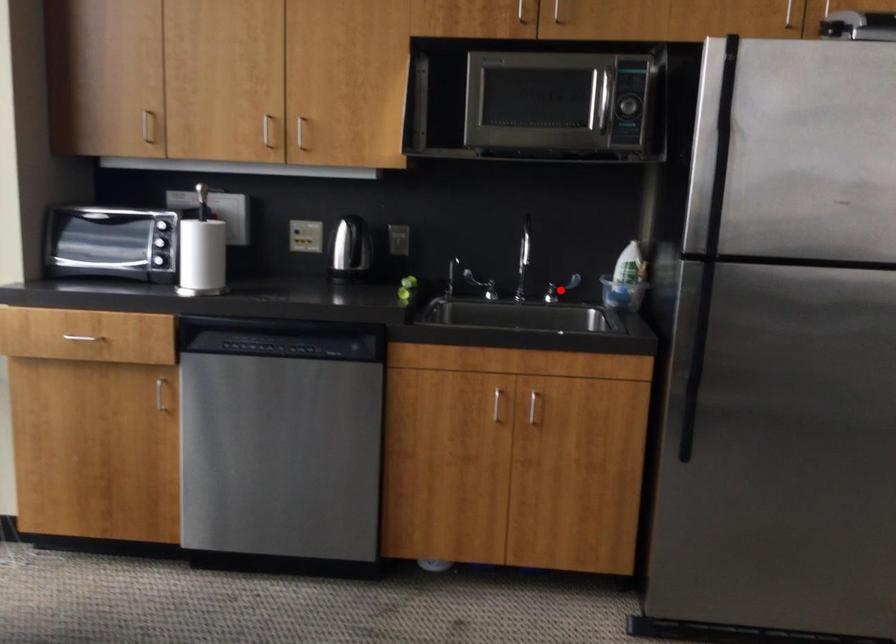
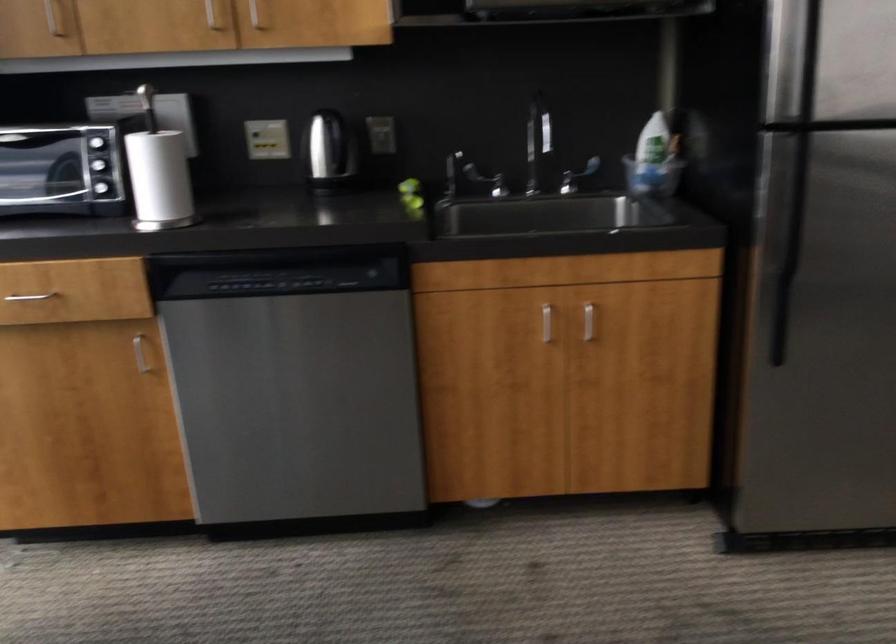
Question: I am providing you with two images of the same scene from different viewpoints. A red point is shown in image1. For the corresponding object point in image2, is it positioned nearer or farther from the camera?

Choices:
 (A) Nearer
 (B) Farther

Answer: (A)